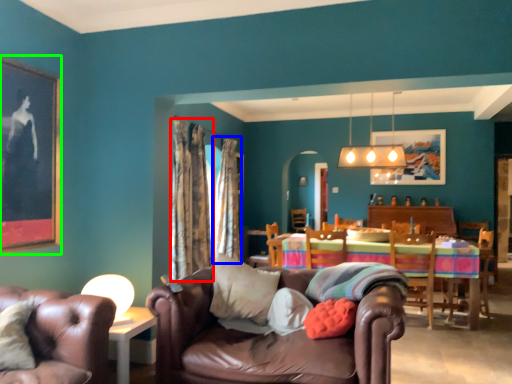
Question: Based on their relative distances, which object is nearer to curtain (highlighted by a red box)? Choose from curtain (highlighted by a blue box) and picture frame (highlighted by a green box).

Choices:
 (A) curtain
 (B) picture frame

Answer: (A)